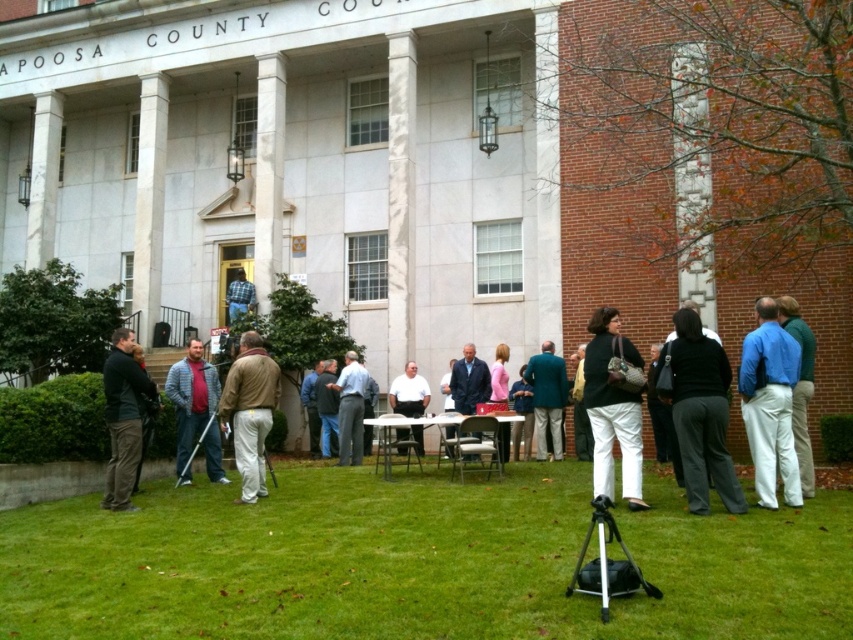
In the scene shown: Who is taller, white fabric purse at center or metallic tripod at lower center?

Standing taller between the two is white fabric purse at center.

How much distance is there between white fabric purse at center and metallic tripod at lower center?

A: white fabric purse at center is 11.35 meters away from metallic tripod at lower center.

Which is behind, point (624, 454) or point (207, 426)?

The point (207, 426) is behind.

I want to click on white fabric purse at center, so click(x=612, y=410).

Which is above, matte gray sweater at center or dark blue shirt at center?

matte gray sweater at center

Between matte gray sweater at center and dark blue shirt at center, which one appears on the right side from the viewer's perspective?

From the viewer's perspective, dark blue shirt at center appears more on the right side.

Locate an element on the screen. The height and width of the screenshot is (640, 853). matte gray sweater at center is located at coordinates (195, 412).

Between dark blue suit at center and pink fabric jacket at center, which one has more height?

pink fabric jacket at center is taller.

Does dark blue suit at center have a larger size compared to pink fabric jacket at center?

No.

The width and height of the screenshot is (853, 640). Identify the location of dark blue suit at center. [x=469, y=381].